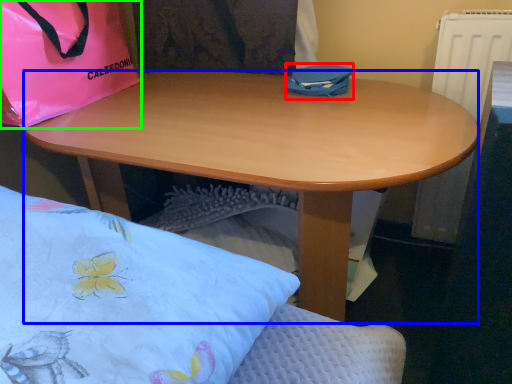
Question: Which object is the closest to the bag (highlighted by a red box)? Choose among these: desk (highlighted by a blue box) or handbag (highlighted by a green box).

Choices:
 (A) desk
 (B) handbag

Answer: (A)